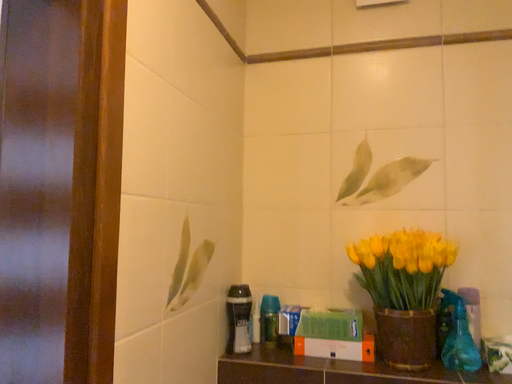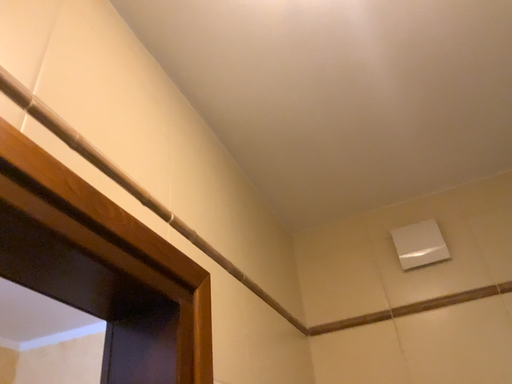
Question: Which way did the camera rotate in the video?

Choices:
 (A) rotated right
 (B) rotated left

Answer: (B)